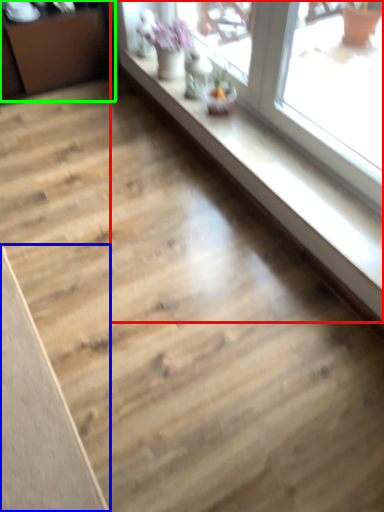
Question: Which is farther away from window (highlighted by a red box)? plank (highlighted by a blue box) or dresser (highlighted by a green box)?

Choices:
 (A) plank
 (B) dresser

Answer: (A)